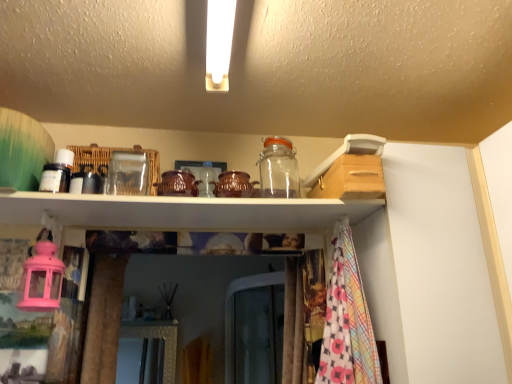
Question: Is transparent glass jar at upper center at the back of white glossy shelf at upper center?

Choices:
 (A) yes
 (B) no

Answer: (B)

Question: Is white glossy shelf at upper center facing towards transparent glass jar at upper center?

Choices:
 (A) yes
 (B) no

Answer: (B)

Question: Is the position of white glossy shelf at upper center more distant than that of transparent glass jar at upper center?

Choices:
 (A) no
 (B) yes

Answer: (A)

Question: Is white glossy shelf at upper center far from transparent glass jar at upper center?

Choices:
 (A) yes
 (B) no

Answer: (B)

Question: Does white glossy shelf at upper center have a smaller size compared to transparent glass jar at upper center?

Choices:
 (A) no
 (B) yes

Answer: (A)

Question: Is transparent glass jar at upper center surrounded by white glossy shelf at upper center?

Choices:
 (A) yes
 (B) no

Answer: (B)

Question: From the image's perspective, is transparent glass jar at upper center located above white glossy shelf at upper center?

Choices:
 (A) no
 (B) yes

Answer: (B)

Question: From the image's perspective, would you say transparent glass jar at upper center is shown under white glossy shelf at upper center?

Choices:
 (A) no
 (B) yes

Answer: (A)

Question: From a real-world perspective, is transparent glass jar at upper center located beneath white glossy shelf at upper center?

Choices:
 (A) yes
 (B) no

Answer: (B)

Question: Is transparent glass jar at upper center not near white glossy shelf at upper center?

Choices:
 (A) yes
 (B) no

Answer: (B)

Question: Considering the relative sizes of transparent glass jar at upper center and white glossy shelf at upper center in the image provided, is transparent glass jar at upper center bigger than white glossy shelf at upper center?

Choices:
 (A) no
 (B) yes

Answer: (A)

Question: Is transparent glass jar at upper center to the left of white glossy shelf at upper center from the viewer's perspective?

Choices:
 (A) no
 (B) yes

Answer: (A)

Question: Looking at their shapes, would you say transparent glass jar at upper center is wider or thinner than white glossy shelf at upper center?

Choices:
 (A) thin
 (B) wide

Answer: (A)